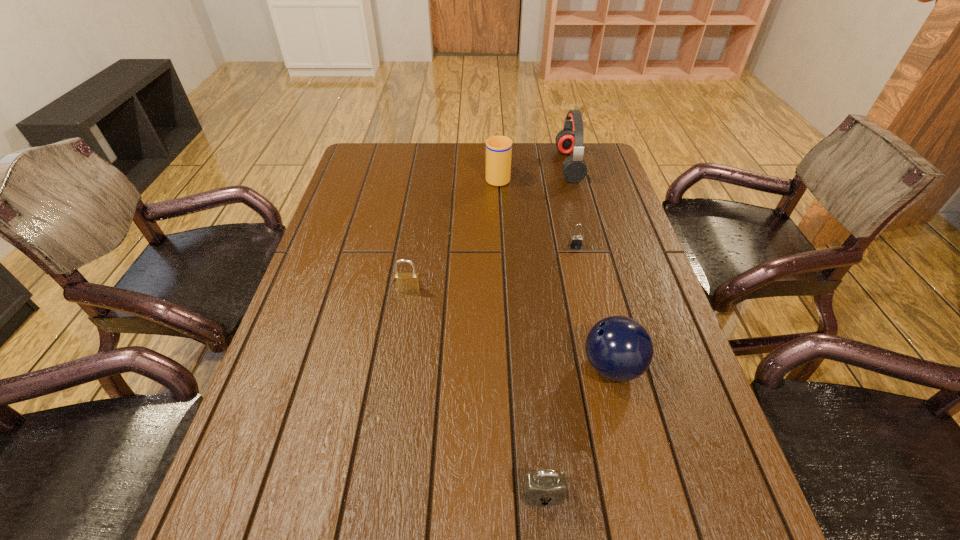
At what (x,y) coordinates should I click in order to perform the action: click on empty location between the second nearest padlock and the cup. Please return your answer as a coordinate pair (x, y). The height and width of the screenshot is (540, 960). Looking at the image, I should click on (453, 233).

Find the location of a particular element. This screenshot has width=960, height=540. free space between the fourth farthest object and the cup is located at coordinates (453, 233).

This screenshot has height=540, width=960. Find the location of `vacant space in between the shortest padlock and the earphone`. vacant space in between the shortest padlock and the earphone is located at coordinates (572, 206).

At what (x,y) coordinates should I click in order to perform the action: click on unoccupied area between the farthest padlock and the second farthest padlock. Please return your answer as a coordinate pair (x, y). Looking at the image, I should click on (492, 268).

I want to click on free space between the earphone and the bowling ball, so point(590,266).

Locate an element on the screen. The width and height of the screenshot is (960, 540). free space between the cup and the rightmost padlock is located at coordinates (537, 212).

Locate an element on the screen. The width and height of the screenshot is (960, 540). free space that is in between the leftmost padlock and the nearest object is located at coordinates (475, 392).

Where is `vacant point located between the third nearest object and the rightmost padlock`? Image resolution: width=960 pixels, height=540 pixels. vacant point located between the third nearest object and the rightmost padlock is located at coordinates (492, 268).

Identify which object is the third nearest to the second padlock from right to left. Please provide its 2D coordinates. Your answer should be formatted as a tuple, i.e. [(x, y)], where the tuple contains the x and y coordinates of a point satisfying the conditions above.

[(576, 241)]

Choose which object is the fourth nearest neighbor to the shortest object. Please provide its 2D coordinates. Your answer should be formatted as a tuple, i.e. [(x, y)], where the tuple contains the x and y coordinates of a point satisfying the conditions above.

[(404, 282)]